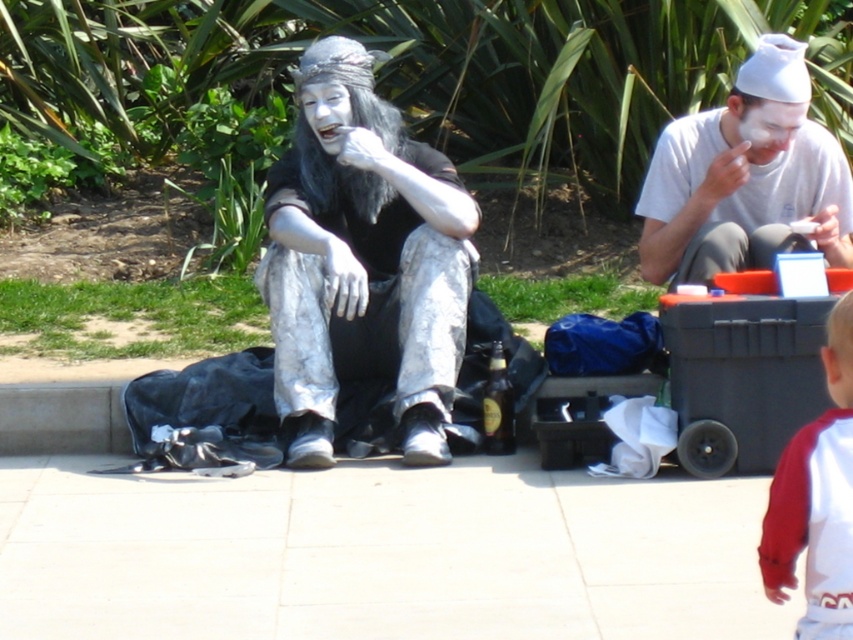
Question: Is silver metallic face paint at center further to camera compared to white matte face paint at center?

Choices:
 (A) no
 (B) yes

Answer: (A)

Question: Which of these objects is positioned farthest from the white tile pavement at lower center?

Choices:
 (A) red jersey at lower right
 (B) silver metallic face paint at center

Answer: (A)

Question: Which point is closer to the camera taking this photo?

Choices:
 (A) (805, 620)
 (B) (462, 220)
 (C) (740, 108)

Answer: (A)

Question: Which point appears farthest from the camera in this image?

Choices:
 (A) (457, 284)
 (B) (787, 68)
 (C) (97, 486)
 (D) (762, 536)

Answer: (A)

Question: Where is silver metallic face paint at center located in relation to white matte face paint at center in the image?

Choices:
 (A) below
 (B) above

Answer: (A)

Question: Is silver metallic face paint at center wider than white matte face paint at center?

Choices:
 (A) no
 (B) yes

Answer: (B)